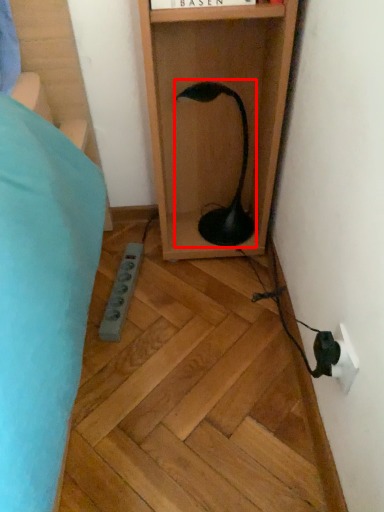
Question: From the image's perspective, considering the relative positions of lamp (annotated by the red box) and electric outlet in the image provided, where is lamp (annotated by the red box) located with respect to the staircase?

Choices:
 (A) above
 (B) below

Answer: (A)